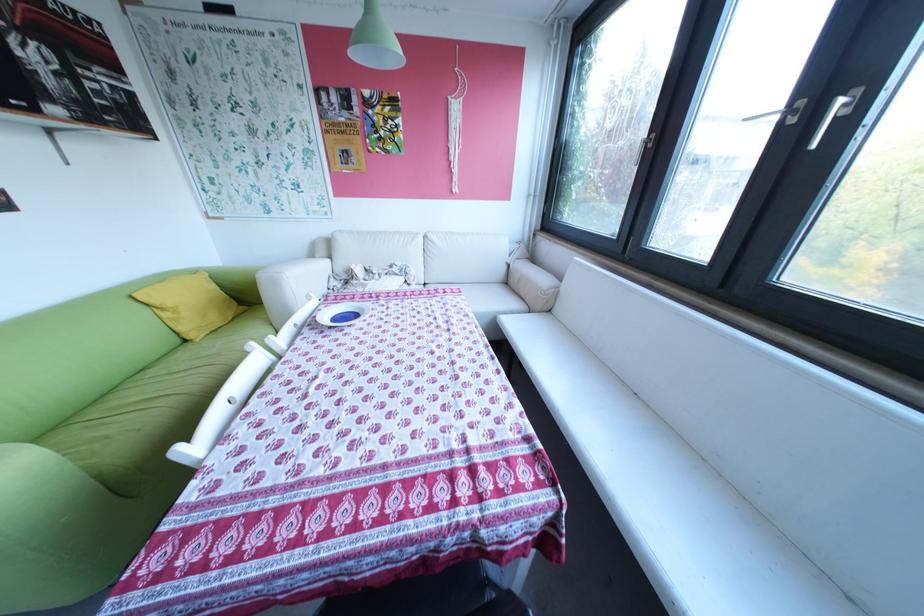
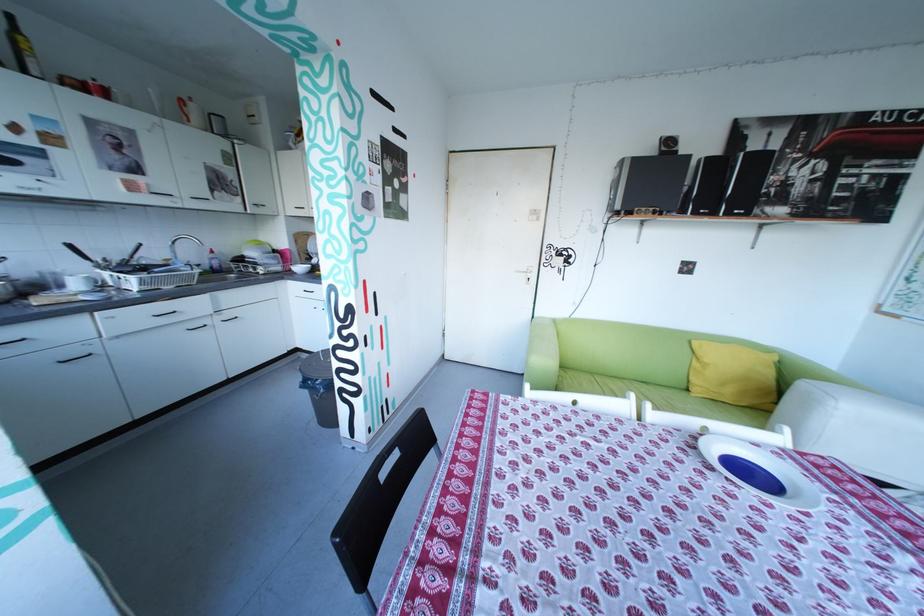
The images are taken continuously from a first-person perspective. In which direction is your viewpoint rotating?

The rotation direction of the camera is left-down.